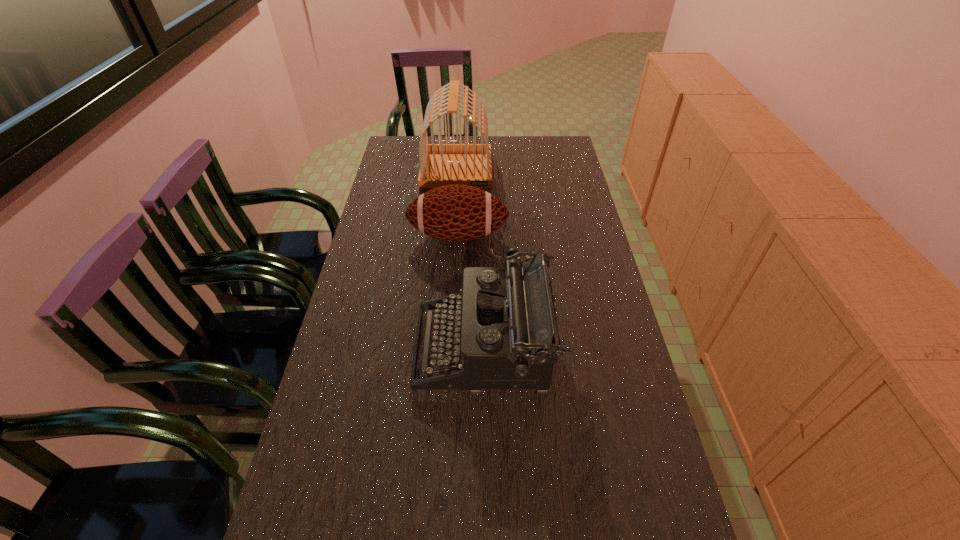
You are a GUI agent. You are given a task and a screenshot of the screen. Output one action in this format:
    pyautogui.click(x=<x>, y=<y>)
    Task: Click on the farthest object
    The image size is (960, 540).
    Given the screenshot: What is the action you would take?
    pyautogui.click(x=441, y=164)

Find the location of a particular element. the tallest object is located at coordinates (441, 164).

The image size is (960, 540). I want to click on typewriter, so click(504, 321).

Locate an element on the screen. the nearest object is located at coordinates (504, 321).

At what (x,y) coordinates should I click in order to perform the action: click on the second nearest object. Please return your answer as a coordinate pair (x, y). The height and width of the screenshot is (540, 960). Looking at the image, I should click on (456, 213).

Locate an element on the screen. This screenshot has width=960, height=540. the shortest object is located at coordinates (456, 213).

In order to click on vacant region located 0.070m with an open door on the birdcage in this screenshot , I will do `click(454, 200)`.

Image resolution: width=960 pixels, height=540 pixels. I want to click on vacant space located 0.070m on the typing side of the typewriter, so click(x=389, y=349).

At what (x,y) coordinates should I click in order to perform the action: click on vacant space located on the typing side of the typewriter. Please return your answer as a coordinate pair (x, y). Image resolution: width=960 pixels, height=540 pixels. Looking at the image, I should click on (389, 349).

The height and width of the screenshot is (540, 960). I want to click on free space located 0.200m on the typing side of the typewriter, so click(x=337, y=349).